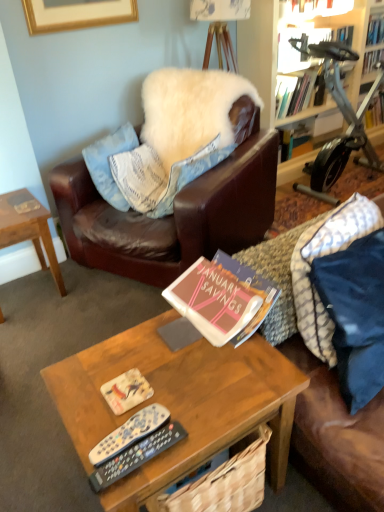
Question: From the image's perspective, is woodenwoodencoffee table at center, which ranks as the second coffee table in left-to-right order, below hardcover book at upper center, which is counted as the 2th book, starting from the front?

Choices:
 (A) yes
 (B) no

Answer: (A)

Question: Considering the relative positions of woodenwoodencoffee table at center, which ranks as the second coffee table in left-to-right order, and hardcover book at upper center, acting as the fifth book starting from the bottom, in the image provided, is woodenwoodencoffee table at center, which ranks as the second coffee table in left-to-right order, to the right of hardcover book at upper center, acting as the fifth book starting from the bottom, from the viewer's perspective?

Choices:
 (A) yes
 (B) no

Answer: (B)

Question: Can you confirm if woodenwoodencoffee table at center, positioned as the second coffee table in back-to-front order, is shorter than hardcover book at upper center, acting as the fifth book starting from the bottom?

Choices:
 (A) no
 (B) yes

Answer: (A)

Question: Is woodenwoodencoffee table at center, which ranks as the second coffee table in left-to-right order, far from hardcover book at upper center, which is counted as the 2th book, starting from the front?

Choices:
 (A) yes
 (B) no

Answer: (A)

Question: Considering the relative positions of woodenwoodencoffee table at center, which appears as the first coffee table when viewed from the right, and hardcover book at upper center, which is counted as the 2th book, starting from the front, in the image provided, is woodenwoodencoffee table at center, which appears as the first coffee table when viewed from the right, in front of hardcover book at upper center, which is counted as the 2th book, starting from the front,?

Choices:
 (A) yes
 (B) no

Answer: (A)

Question: From a real-world perspective, relative to white fluffy pillow at upper center, the 1th pillow in the back-to-front sequence, is brown woven basket at center vertically above or below?

Choices:
 (A) below
 (B) above

Answer: (A)

Question: Is brown woven basket at center taller or shorter than white fluffy pillow at upper center, the 1th pillow in the back-to-front sequence?

Choices:
 (A) tall
 (B) short

Answer: (B)

Question: From the image's perspective, is brown woven basket at center above or below white fluffy pillow at upper center, the 1th pillow in the back-to-front sequence?

Choices:
 (A) above
 (B) below

Answer: (B)

Question: Considering the positions of brown woven basket at center and white fluffy pillow at upper center, the 1th pillow in the back-to-front sequence, in the image, is brown woven basket at center wider or thinner than white fluffy pillow at upper center, the 1th pillow in the back-to-front sequence,?

Choices:
 (A) thin
 (B) wide

Answer: (A)

Question: In terms of height, does silver metallic stationary bicycle at upper right look taller or shorter compared to hardcover book at upper right, which appears as the 2th book when viewed from the top?

Choices:
 (A) tall
 (B) short

Answer: (A)

Question: Considering the positions of silver metallic stationary bicycle at upper right and hardcover book at upper right, which appears as the 4th book when ordered from the bottom, in the image, is silver metallic stationary bicycle at upper right wider or thinner than hardcover book at upper right, which appears as the 4th book when ordered from the bottom,?

Choices:
 (A) wide
 (B) thin

Answer: (A)

Question: Based on their positions, is silver metallic stationary bicycle at upper right located to the left or right of hardcover book at upper right, marked as the fifth book in a front-to-back arrangement?

Choices:
 (A) left
 (B) right

Answer: (A)

Question: From a real-world perspective, is silver metallic stationary bicycle at upper right above or below hardcover book at upper right, which appears as the 2th book when viewed from the top?

Choices:
 (A) below
 (B) above

Answer: (A)

Question: Is brown woven basket at center situated inside hardcover book at upper right, marked as the fifth book in a front-to-back arrangement, or outside?

Choices:
 (A) outside
 (B) inside

Answer: (A)

Question: Looking at the image, does brown woven basket at center seem bigger or smaller compared to hardcover book at upper right, marked as the fifth book in a front-to-back arrangement?

Choices:
 (A) big
 (B) small

Answer: (A)